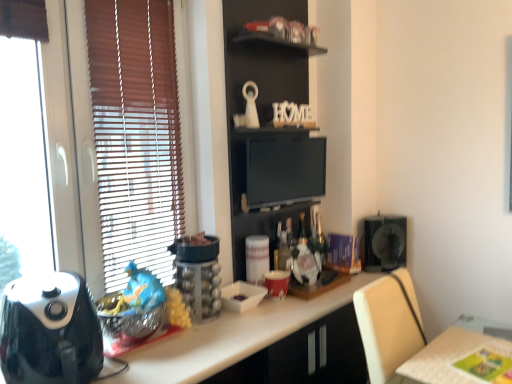
The width and height of the screenshot is (512, 384). I want to click on vacant space underneath white glossy bowl at center, the third appliance from the front (from a real-world perspective), so click(x=240, y=308).